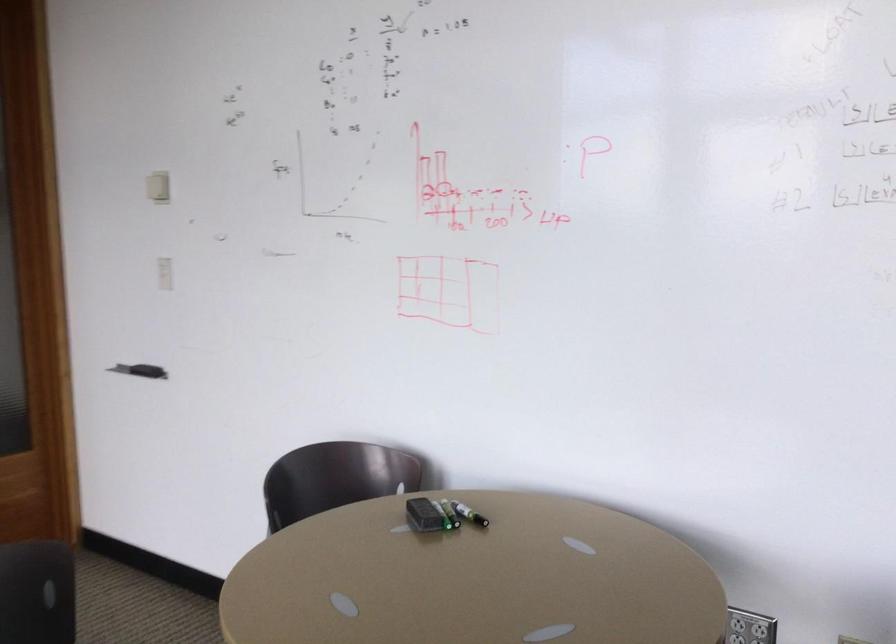
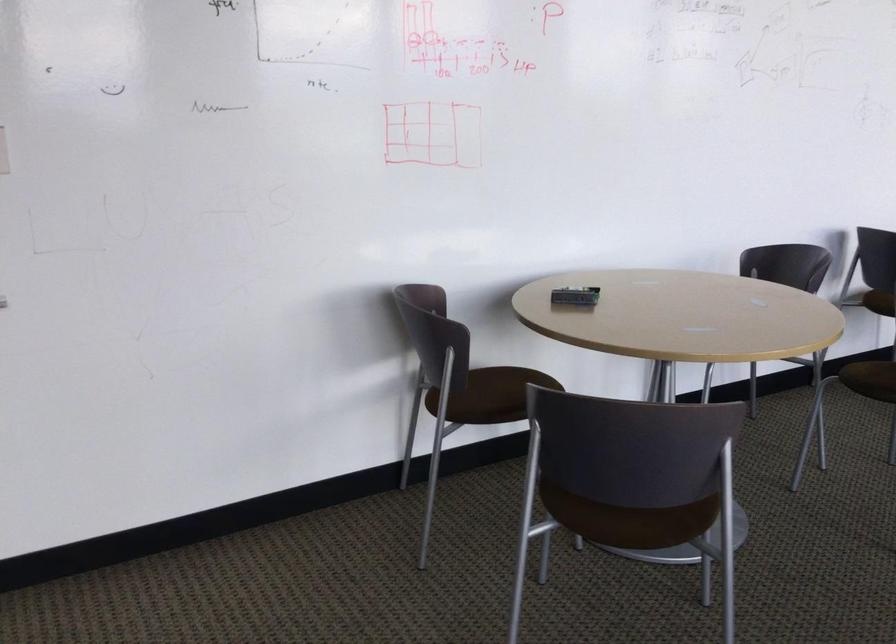
In the second image, find the point that corresponds to the point at 432,516 in the first image.

(575, 296)